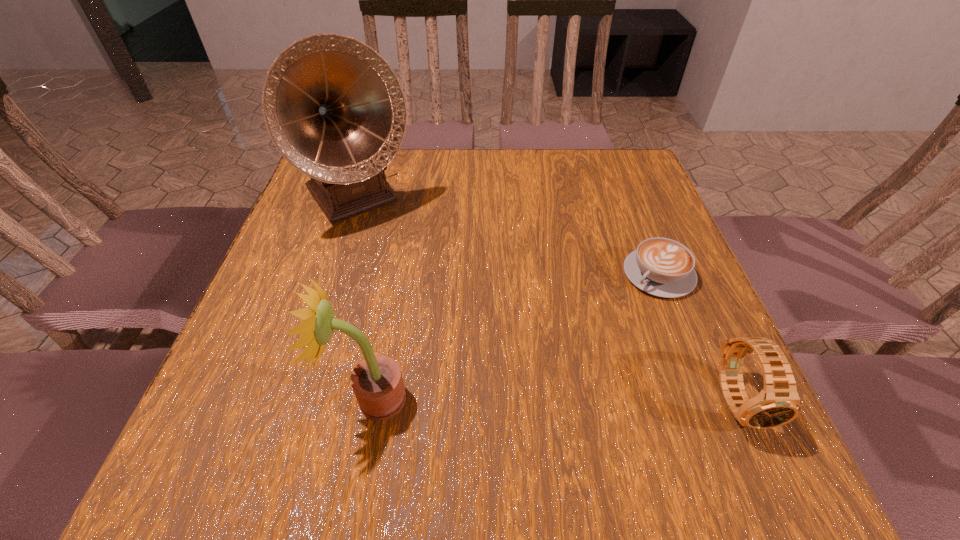
Image resolution: width=960 pixels, height=540 pixels. Identify the location of cappuccino that is at the right edge. (662, 267).

Locate an element on the screen. The height and width of the screenshot is (540, 960). object located at the far left corner is located at coordinates (335, 110).

This screenshot has width=960, height=540. In order to click on object that is at the near right corner in this screenshot , I will do `click(778, 403)`.

Locate an element on the screen. The image size is (960, 540). free region at the far edge is located at coordinates (407, 160).

This screenshot has height=540, width=960. What are the coordinates of `vacant space at the left edge` in the screenshot? It's located at (306, 226).

What are the coordinates of `vacant space at the right edge of the desktop` in the screenshot? It's located at (611, 256).

This screenshot has height=540, width=960. In order to click on free space at the near left corner in this screenshot , I will do `click(252, 384)`.

Locate an element on the screen. vacant space at the far right corner of the desktop is located at coordinates (629, 159).

I want to click on vacant area that lies between the phonograph record and the second tallest object, so click(366, 299).

You are a GUI agent. You are given a task and a screenshot of the screen. Output one action in this format:
    pyautogui.click(x=<x>, y=<y>)
    Task: Click on the empty space between the sunflower and the watch
    
    Given the screenshot: What is the action you would take?
    pyautogui.click(x=555, y=400)